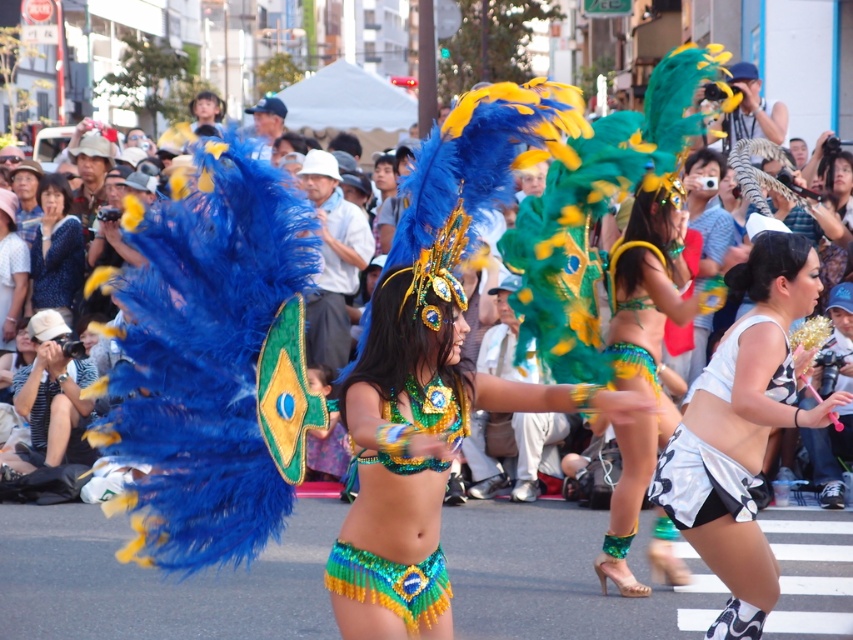
You are a photographer at the festival and want to capture the dancer at point [664,310] and the dancer at point [718,470] in the same frame. Which dancer is positioned closer to the camera?

Point [718,470] is closer to the camera than point [664,310], so the dancer at point [718,470] is closer.

You are a photographer at the festival and want to capture both the green sequined bikini at center and the blue sequined blouse at upper left in a single shot. Which object should you focus on first to ensure both are in frame?

The green sequined bikini at center is much taller than the blue sequined blouse at upper left, so focusing on the green sequined bikini at center first will help ensure both are in frame.

You are a photographer standing at the back of the crowd. You want to take a photo of the green sequined bikini at center and the white glossy shorts at lower right in the same frame. Can you estimate if they can be captured in a single shot with a standard camera lens that has a 5 feet field of view?

The distance between the green sequined bikini at center and the white glossy shorts at lower right is 6.35 feet. Since the camera lens has a 5 feet field of view, which is shorter than the distance between them, it might be challenging to capture both in a single shot without zooming out further or moving closer.